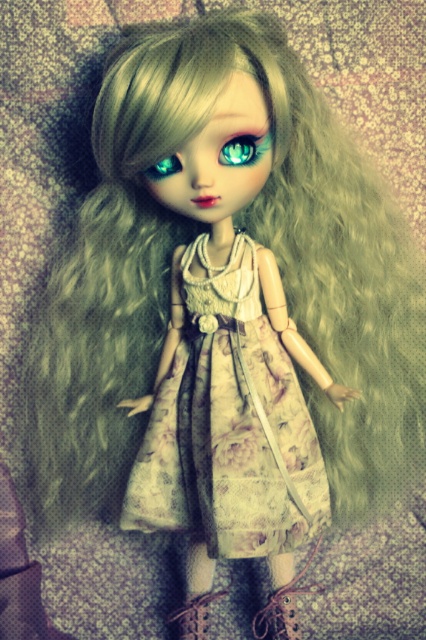
The image size is (426, 640). What do you see at coordinates (284, 608) in the screenshot?
I see `matte brown boot at lower center` at bounding box center [284, 608].

Which is above, matte brown boot at lower center or teal glossy eye at center?

Positioned higher is teal glossy eye at center.

What are the coordinates of `matte brown boot at lower center` in the screenshot? It's located at tap(284, 608).

Who is shorter, matte brown boot at lower center or leather boot at lower center?

leather boot at lower center is shorter.

Which is behind, point (264, 604) or point (184, 611)?

Positioned behind is point (264, 604).

Where is `matte brown boot at lower center`? matte brown boot at lower center is located at coordinates (284, 608).

Is printed fabric dress at center thinner than matte brown boot at lower center?

In fact, printed fabric dress at center might be wider than matte brown boot at lower center.

Which is above, printed fabric dress at center or matte brown boot at lower center?

printed fabric dress at center is above.

You are a GUI agent. You are given a task and a screenshot of the screen. Output one action in this format:
    pyautogui.click(x=<x>, y=<y>)
    Task: Click on the printed fabric dress at center
    This screenshot has width=426, height=640.
    Given the screenshot: What is the action you would take?
    pyautogui.click(x=229, y=424)